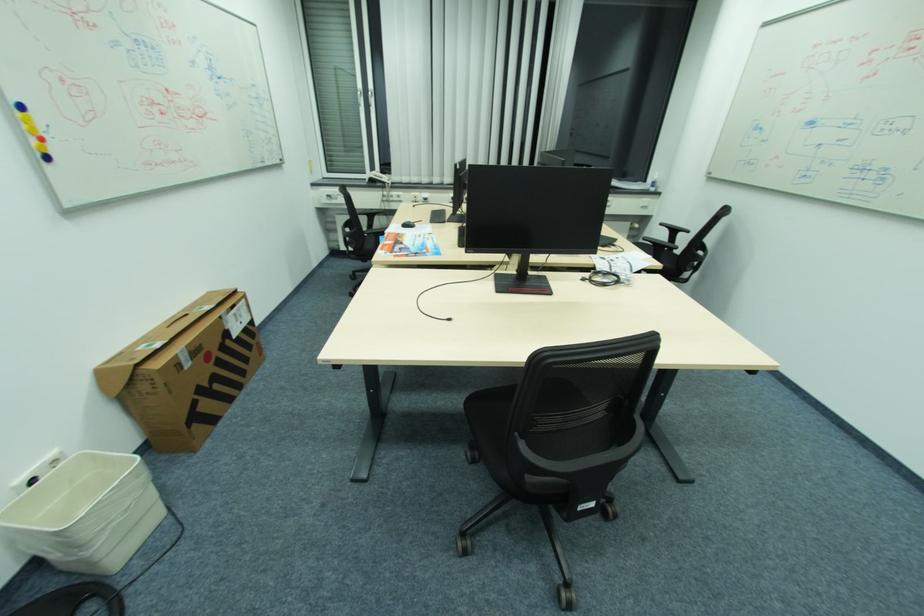
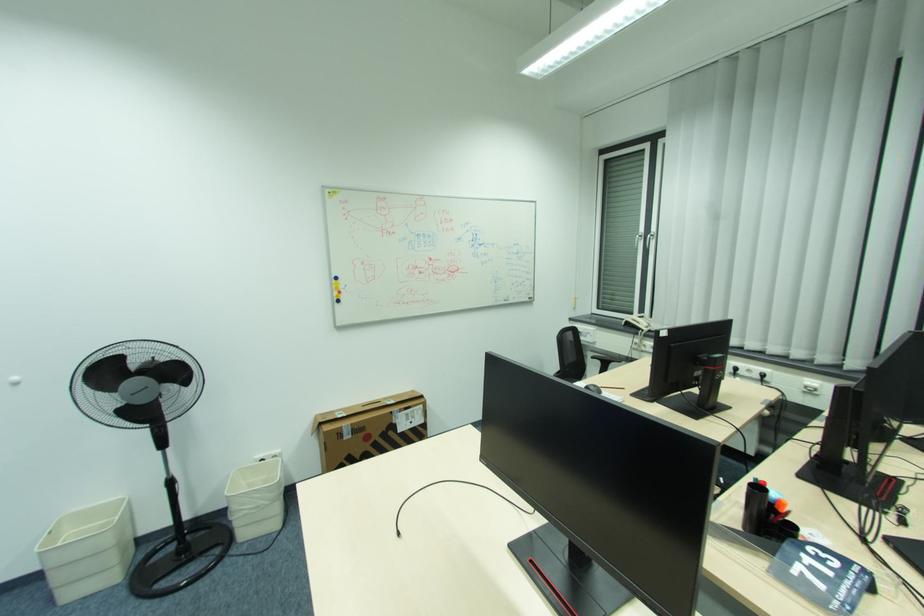
The point at (392, 179) is marked in the first image. Where is the corresponding point in the second image?

(650, 325)